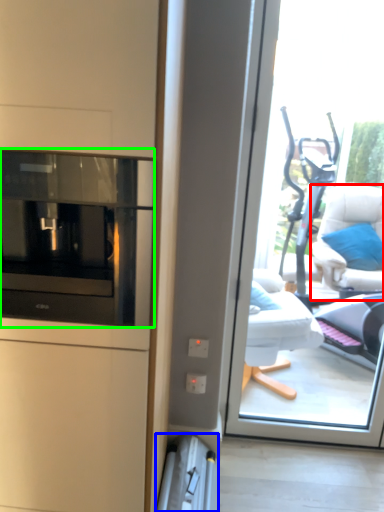
Question: Estimate the real-world distances between objects in this image. Which object is farther from furniture (highlighted by a red box), appliance (highlighted by a blue box) or home appliance (highlighted by a green box)?

Choices:
 (A) appliance
 (B) home appliance

Answer: (B)